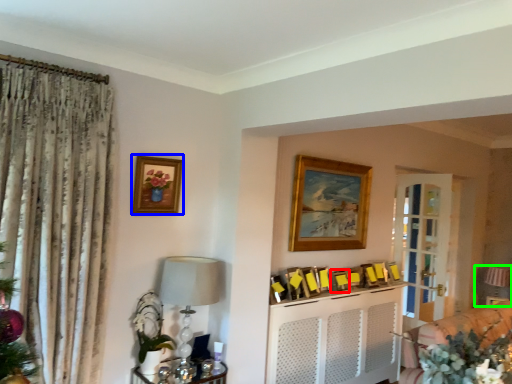
Question: Estimate the real-world distances between objects in this image. Which object is closer to picture frame (highlighted by a red box), picture frame (highlighted by a blue box) or furniture (highlighted by a green box)?

Choices:
 (A) picture frame
 (B) furniture

Answer: (A)